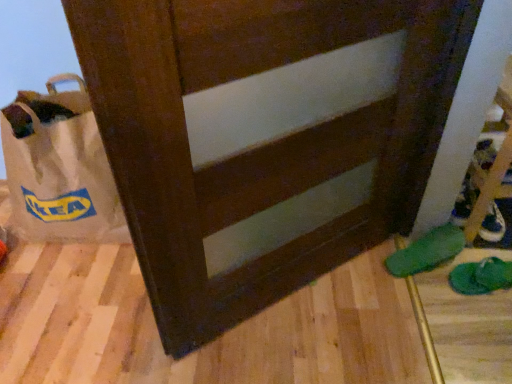
The width and height of the screenshot is (512, 384). I want to click on vacant space situated on the left part of green fabric slipper at lower right, acting as the second footwear starting from the left, so click(x=439, y=296).